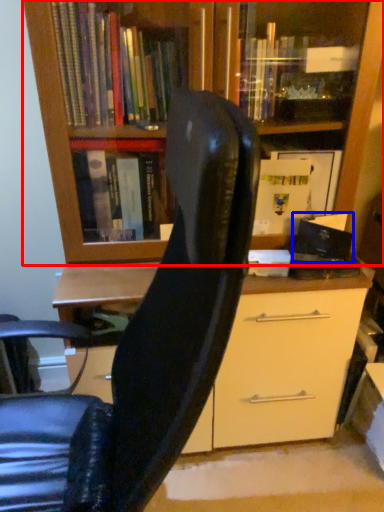
Question: Which object is further to the camera taking this photo, bookcase (highlighted by a red box) or paperback book (highlighted by a blue box)?

Choices:
 (A) bookcase
 (B) paperback book

Answer: (B)